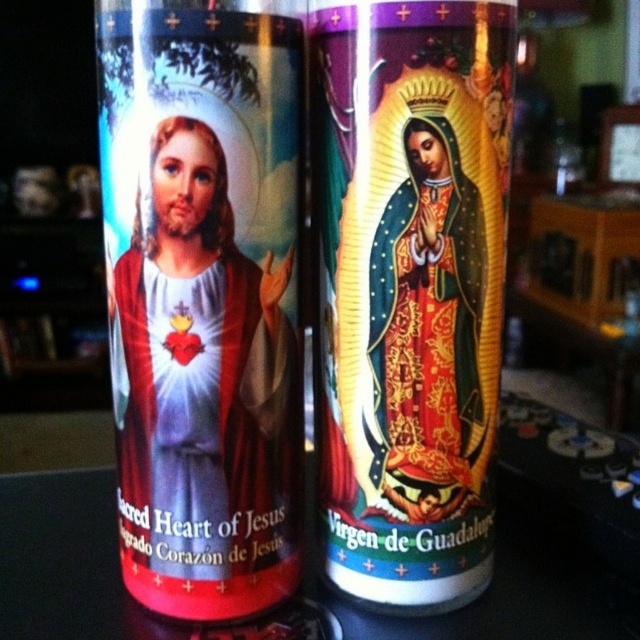
Can you confirm if matte red candle at left is positioned above matte gold virgin of guadalupe at center?

No, matte red candle at left is not above matte gold virgin of guadalupe at center.

Who is shorter, matte red candle at left or matte gold virgin of guadalupe at center?

matte red candle at left

This screenshot has width=640, height=640. I want to click on matte red candle at left, so click(202, 300).